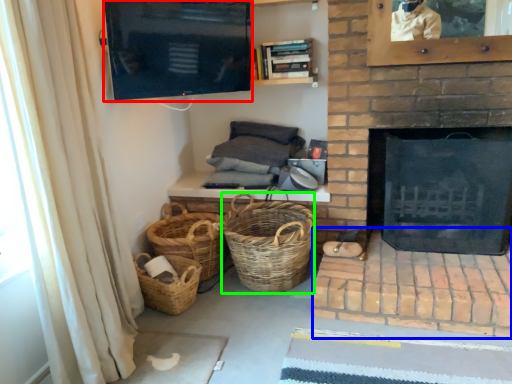
Question: Based on their relative distances, which object is nearer to screen door (highlighted by a red box)? Choose from brickwork (highlighted by a blue box) and basket (highlighted by a green box).

Choices:
 (A) brickwork
 (B) basket

Answer: (B)